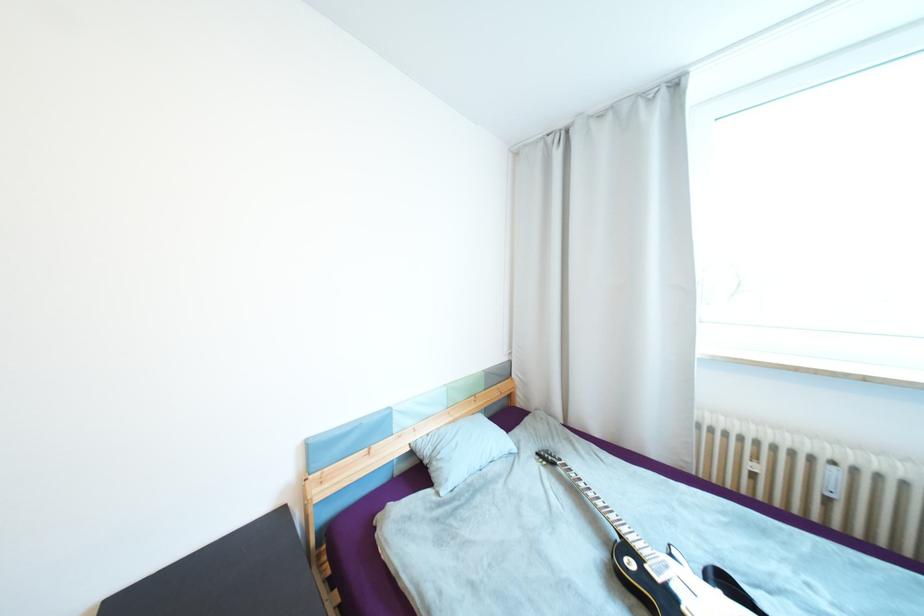
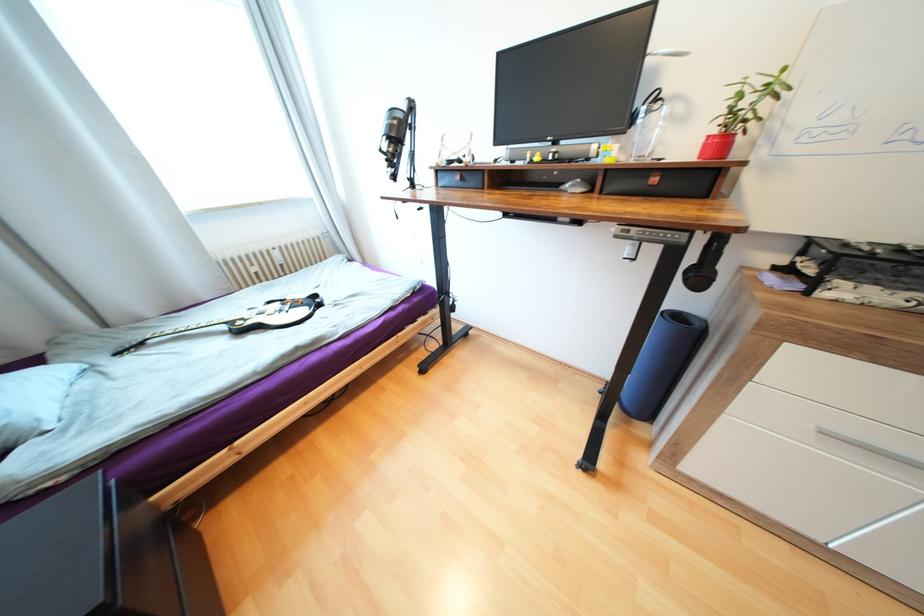
Based on the continuous images, in which direction is the camera rotating?

The camera rotated toward right-down.